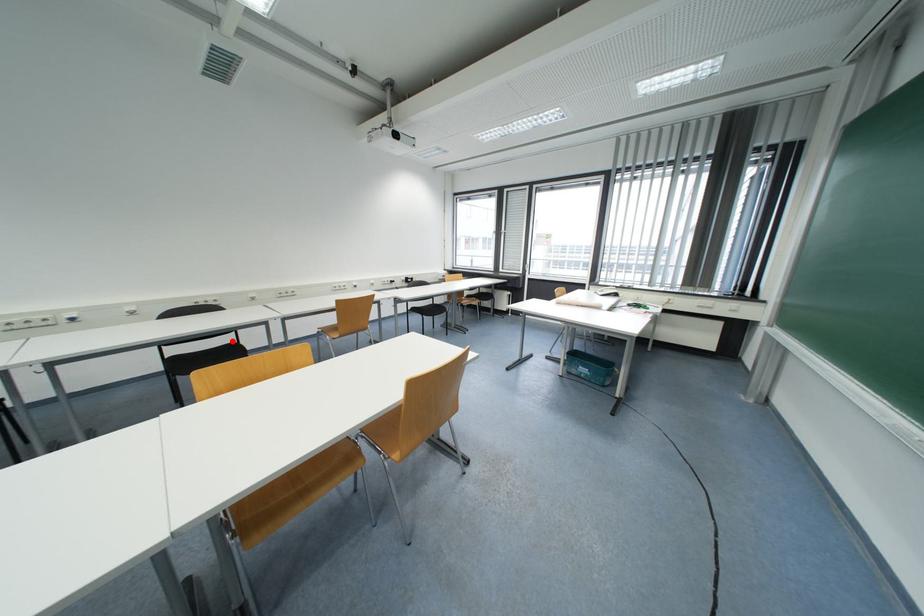
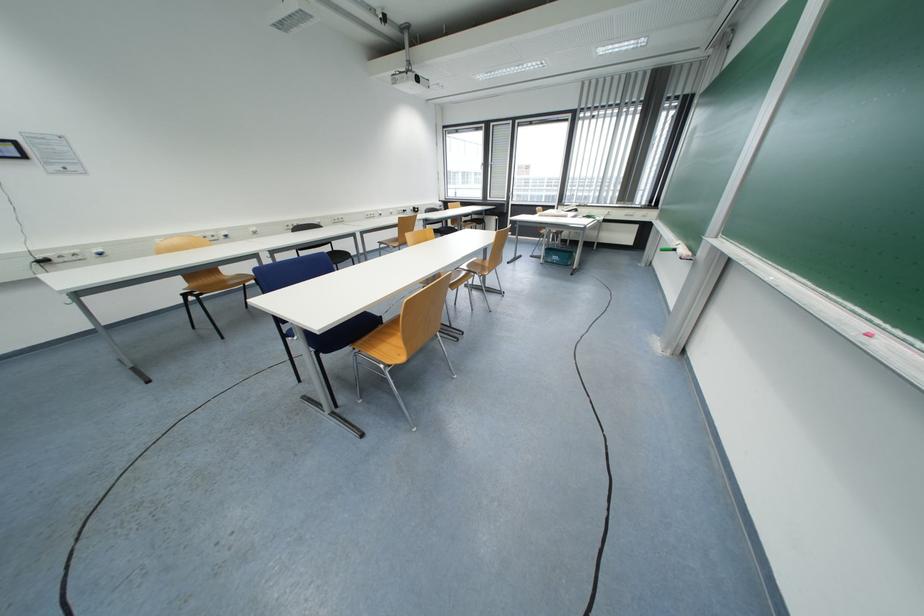
The point at the highlighted location is marked in the first image. Where is the corresponding point in the second image?

(332, 251)